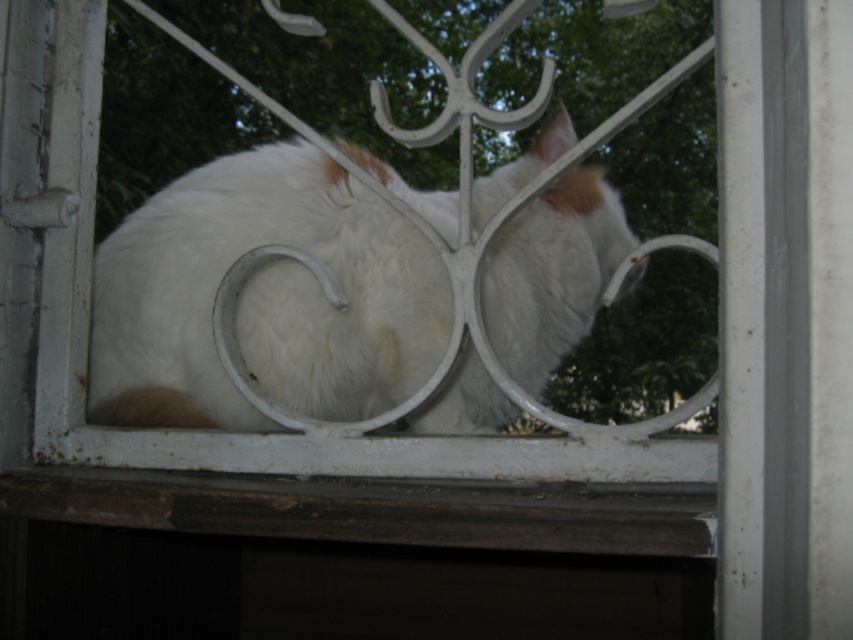
Which is in front, point (495, 257) or point (250, 532)?

Point (250, 532) is in front.

Is white fluffy cat at center closer to camera compared to brown wood at bottom?

No, white fluffy cat at center is further to the viewer.

Describe the element at coordinates (263, 298) in the screenshot. I see `white fluffy cat at center` at that location.

Identify the location of white fluffy cat at center. Image resolution: width=853 pixels, height=640 pixels. (263, 298).